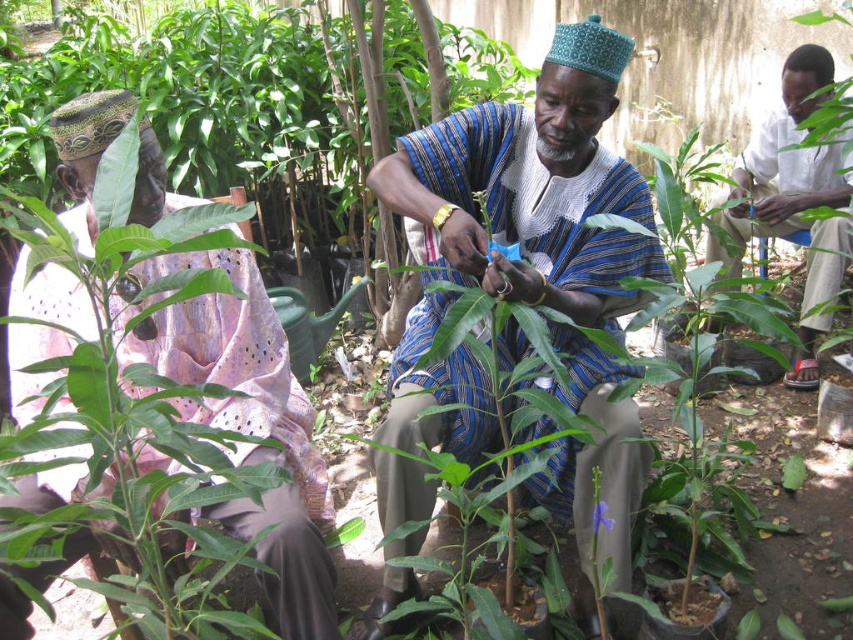
You are a gardener looking at the scene. There is a point at coordinates (534,188). What object is located at that point?

The blue striped cloth at center is located at point (534,188).